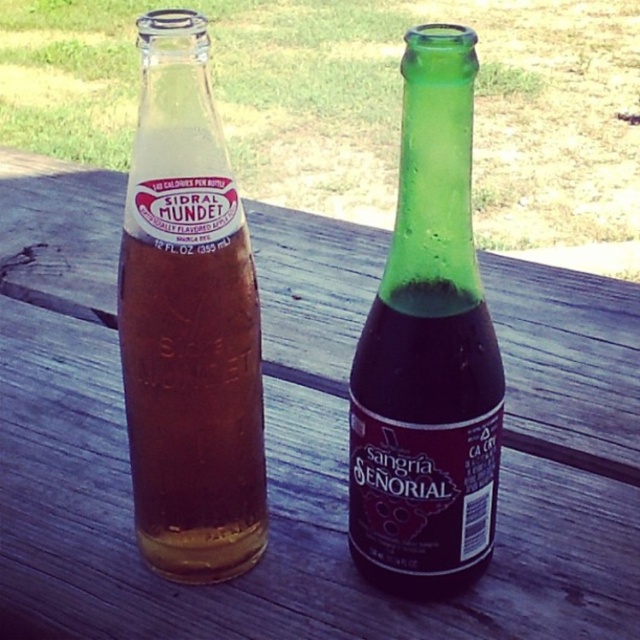
Question: Is translucent glass bottle at left thinner than green glass bottle at center?

Choices:
 (A) no
 (B) yes

Answer: (A)

Question: Which point is farther from the camera taking this photo?

Choices:
 (A) (429, 556)
 (B) (204, 221)

Answer: (A)

Question: Among these points, which one is nearest to the camera?

Choices:
 (A) pyautogui.click(x=193, y=211)
 (B) pyautogui.click(x=499, y=426)

Answer: (A)

Question: Is translucent glass bottle at left to the left of green glass bottle at center from the viewer's perspective?

Choices:
 (A) yes
 (B) no

Answer: (A)

Question: Which point is farther to the camera?

Choices:
 (A) translucent glass bottle at left
 (B) green glass bottle at center

Answer: (A)

Question: Is translucent glass bottle at left thinner than green glass bottle at center?

Choices:
 (A) yes
 (B) no

Answer: (B)